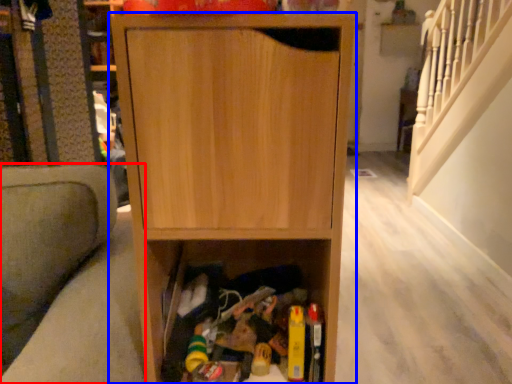
Question: Which point is further to the camera, armchair (highlighted by a red box) or cabinetry (highlighted by a blue box)?

Choices:
 (A) armchair
 (B) cabinetry

Answer: (B)